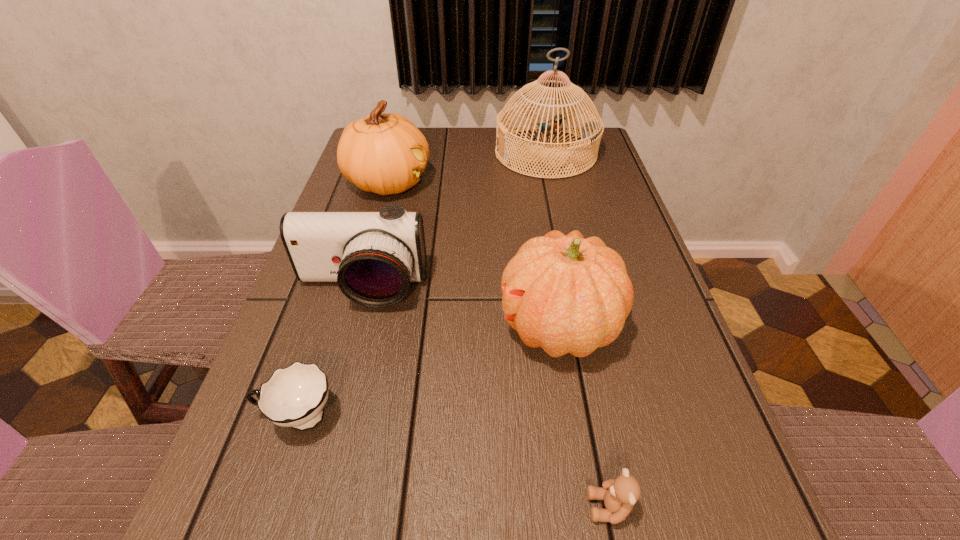
Find the location of a particular element. The height and width of the screenshot is (540, 960). birdcage at the right edge is located at coordinates (591, 132).

Find the location of a particular element. pumpkin positioned at the right edge is located at coordinates (567, 294).

Locate an element on the screen. The height and width of the screenshot is (540, 960). object positioned at the far left corner is located at coordinates (385, 153).

Identify the location of object situated at the far right corner. This screenshot has height=540, width=960. (591, 132).

You are a GUI agent. You are given a task and a screenshot of the screen. Output one action in this format:
    pyautogui.click(x=<x>, y=<y>)
    Task: Click on the free space at the far edge of the desktop
    
    Given the screenshot: What is the action you would take?
    pyautogui.click(x=492, y=156)

In the image, there is a desktop. Identify the location of vacant space at the left edge. Image resolution: width=960 pixels, height=540 pixels. (259, 428).

Locate an element on the screen. Image resolution: width=960 pixels, height=540 pixels. blank space at the right edge is located at coordinates (599, 185).

The width and height of the screenshot is (960, 540). I want to click on free space between the tallest object and the fourth tallest object, so click(x=454, y=221).

Identify the location of empty space that is in between the right pumpkin and the camcorder. The width and height of the screenshot is (960, 540). (460, 308).

Locate an element on the screen. The width and height of the screenshot is (960, 540). vacant space in between the camcorder and the cup is located at coordinates (330, 353).